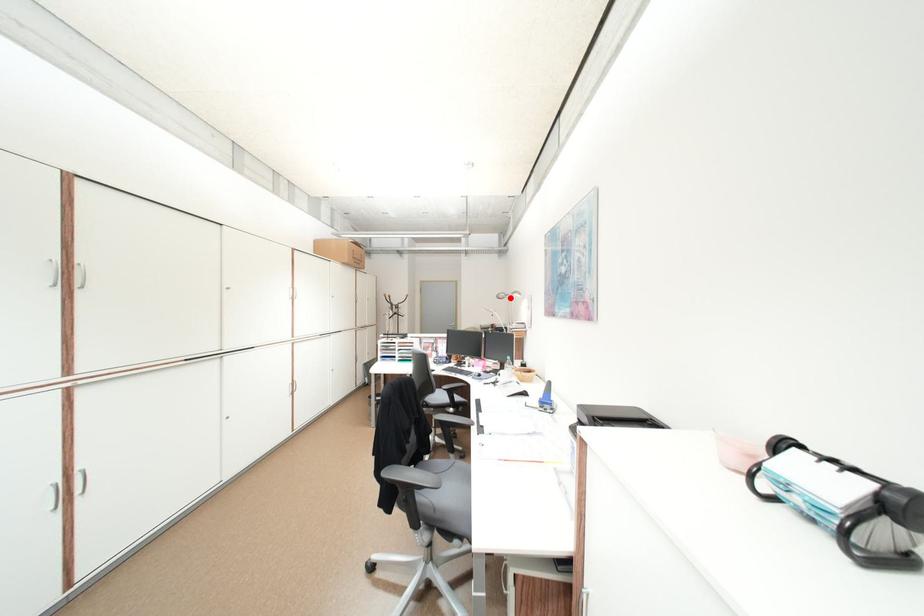
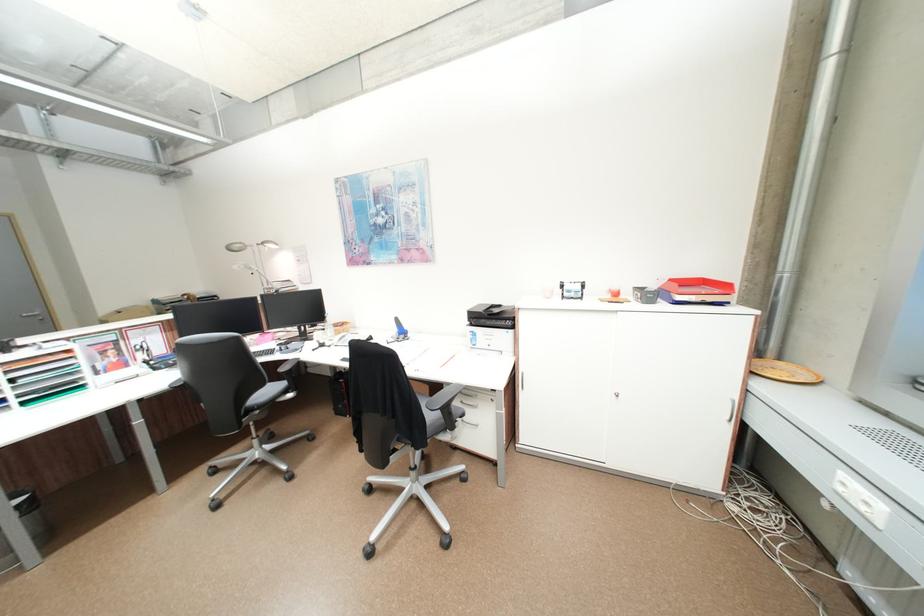
Find the pixel in the second image that matches the highlighted location in the first image.

(245, 249)